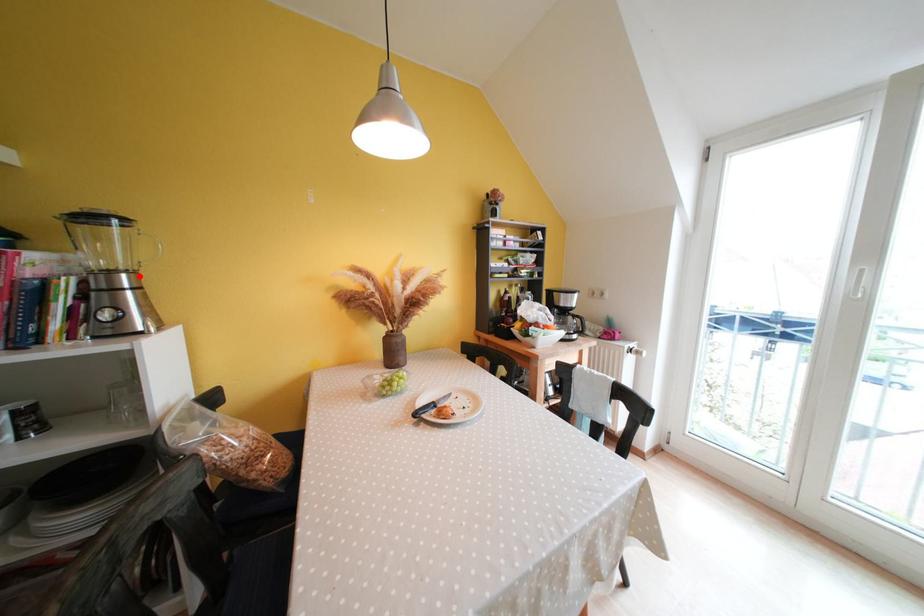
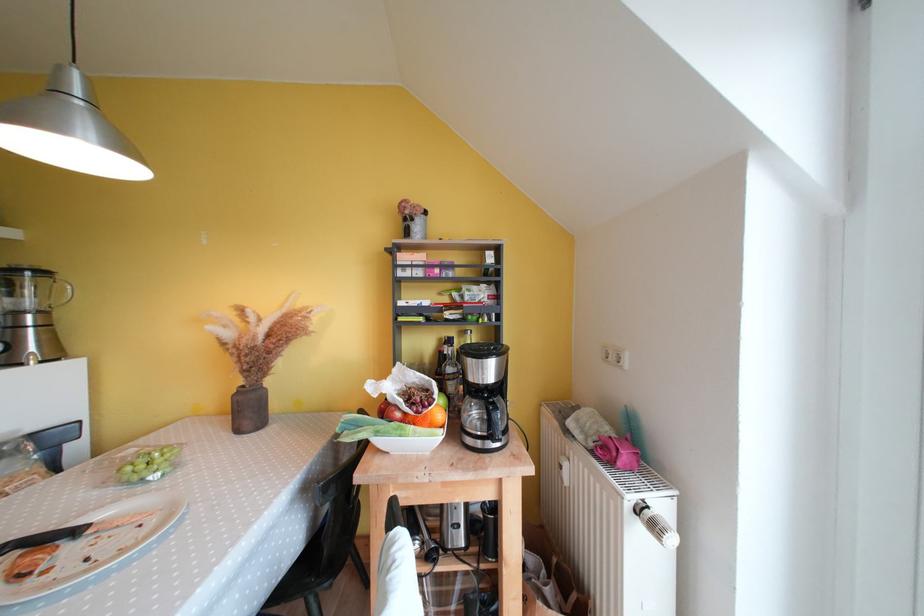
Where in the second image is the point corresponding to the highlighted location from the first image?

(49, 315)